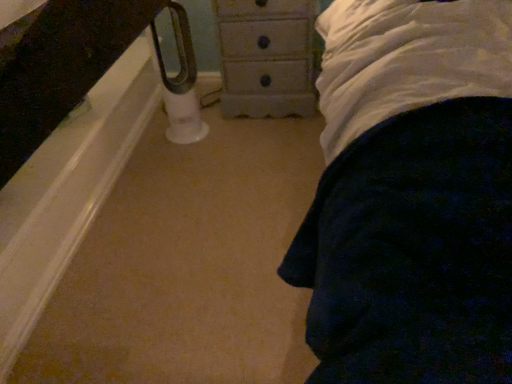
Question: Based on their sizes in the image, would you say white painted wood chest of drawers at center is bigger or smaller than white plastic towel bar at lower left?

Choices:
 (A) big
 (B) small

Answer: (A)

Question: In the image, is white painted wood chest of drawers at center positioned in front of or behind white plastic towel bar at lower left?

Choices:
 (A) front
 (B) behind

Answer: (B)

Question: Is white painted wood chest of drawers at center situated inside white plastic towel bar at lower left or outside?

Choices:
 (A) outside
 (B) inside

Answer: (A)

Question: Is white plastic towel bar at lower left wider or thinner than white painted wood chest of drawers at center?

Choices:
 (A) thin
 (B) wide

Answer: (A)

Question: Looking at the image, does white plastic towel bar at lower left seem bigger or smaller compared to white painted wood chest of drawers at center?

Choices:
 (A) small
 (B) big

Answer: (A)

Question: Would you say white plastic towel bar at lower left is to the left or to the right of white painted wood chest of drawers at center in the picture?

Choices:
 (A) left
 (B) right

Answer: (A)

Question: Does point (192, 100) appear closer or farther from the camera than point (306, 77)?

Choices:
 (A) closer
 (B) farther

Answer: (B)